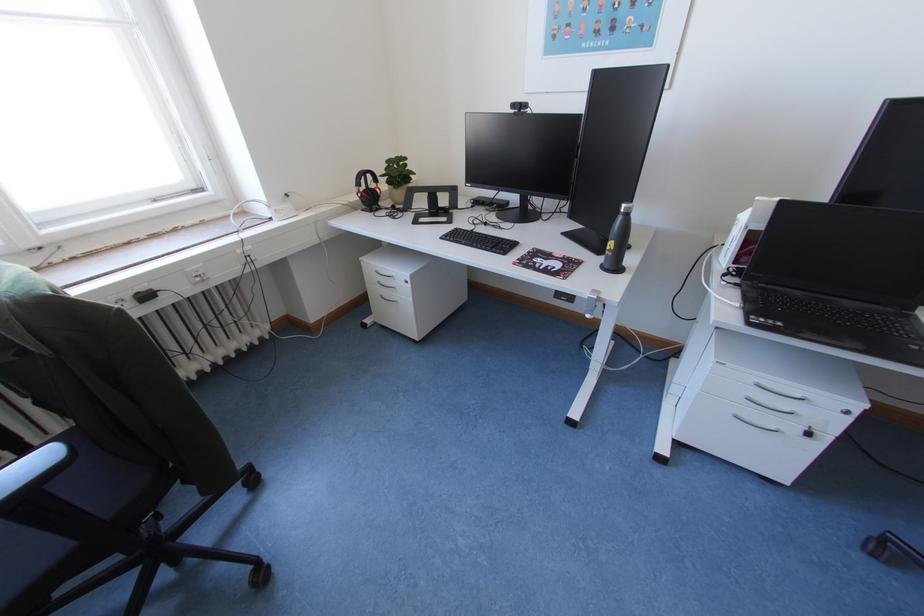
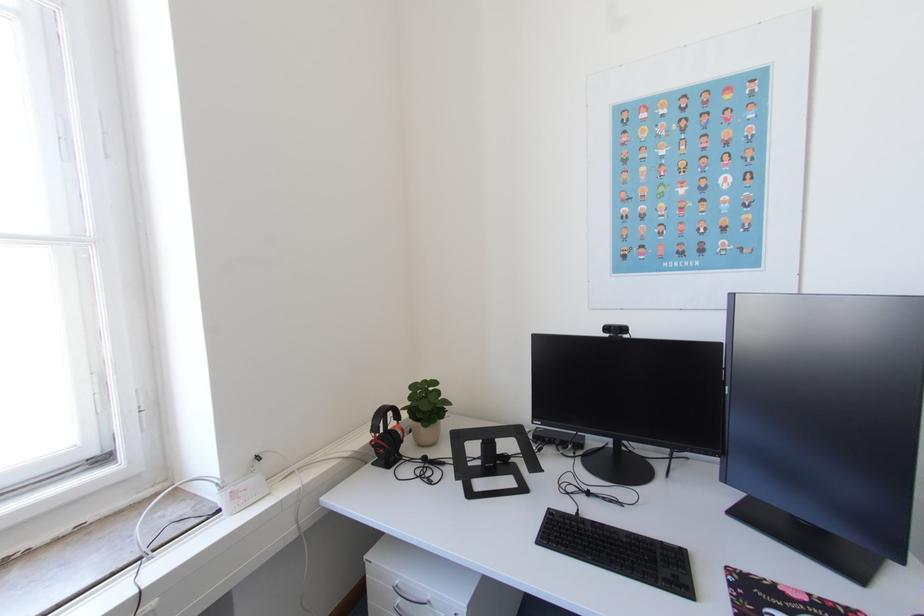
Question: Based on the continuous images, in which direction is the camera rotating? Reply with the corresponding letter.

Choices:
 (A) Left
 (B) Right
 (C) Up
 (D) Down

Answer: (C)